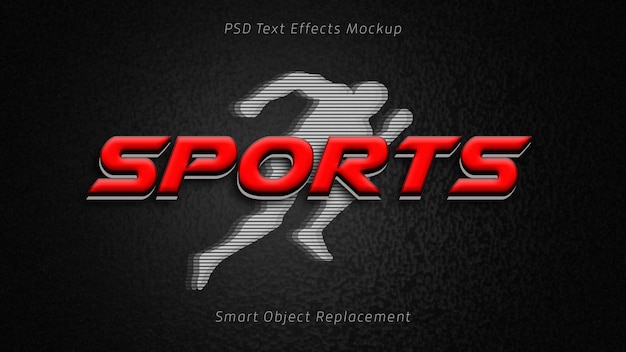
Identify the location of chest. (332, 120).